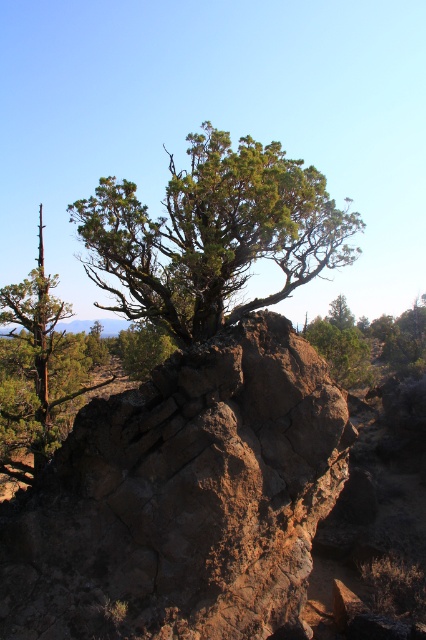
Question: Does brown rough rock at center appear under green leafy tree at center?

Choices:
 (A) yes
 (B) no

Answer: (A)

Question: Among these points, which one is farthest from the camera?

Choices:
 (A) (322, 336)
 (B) (245, 556)
 (C) (227, 288)

Answer: (A)

Question: Estimate the real-world distances between objects in this image. Which object is closer to the green leafy tree at center?

Choices:
 (A) brown rough rock at center
 (B) green rough textured tree at center

Answer: (A)

Question: Does brown rough rock at center have a larger size compared to green rough textured tree at center?

Choices:
 (A) yes
 (B) no

Answer: (B)

Question: Estimate the real-world distances between objects in this image. Which object is farther from the brown rough rock at center?

Choices:
 (A) green leafy tree at center
 (B) green rough textured tree at center

Answer: (B)

Question: Can you confirm if brown rough rock at center is thinner than green leafy tree at center?

Choices:
 (A) no
 (B) yes

Answer: (B)